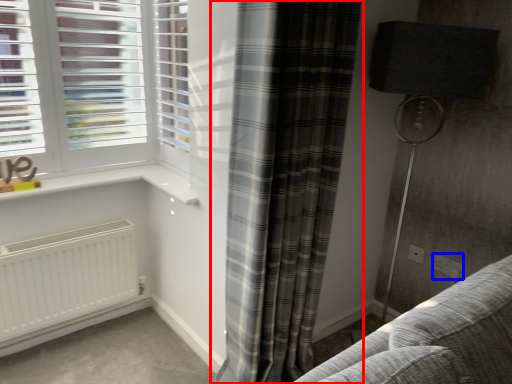
Question: Among these objects, which one is farthest to the camera, curtain (highlighted by a red box) or electric outlet (highlighted by a blue box)?

Choices:
 (A) curtain
 (B) electric outlet

Answer: (B)